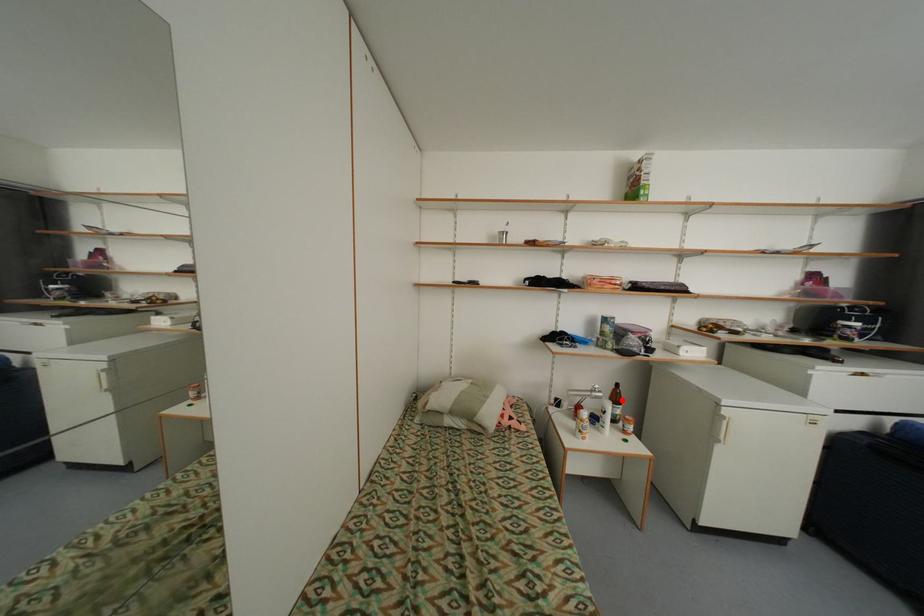
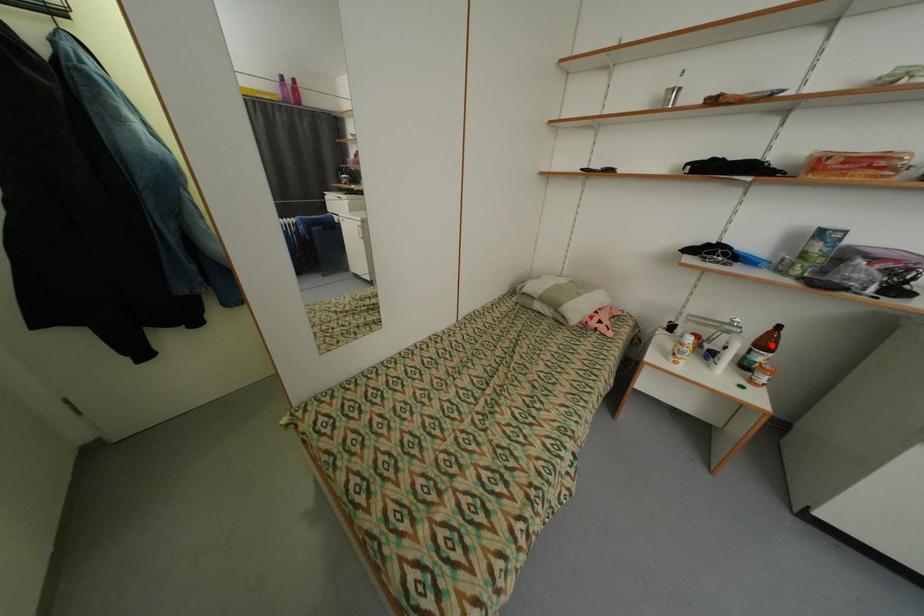
I am providing you with two images of the same scene from different viewpoints. A red point is marked on the first image and another point is marked on the second image. Is the red point in image1 aligned with the point shown in image2?

Yes